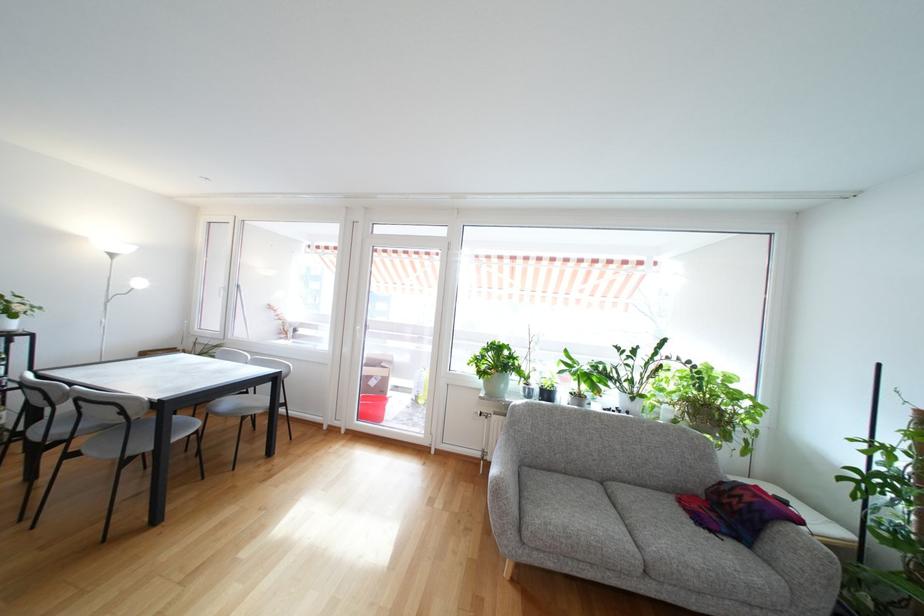
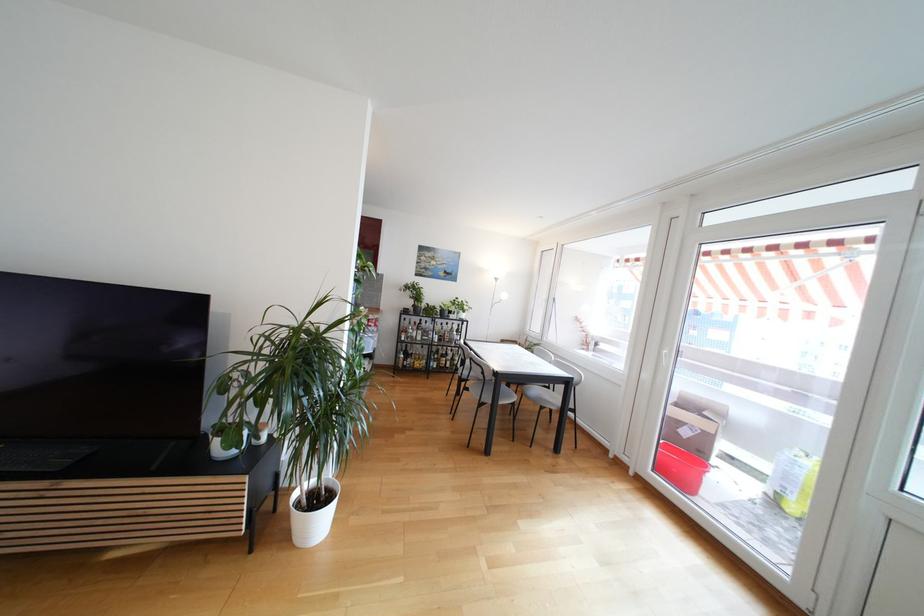
Find the pixel in the second image that matches point (260, 395) in the first image.

(557, 392)